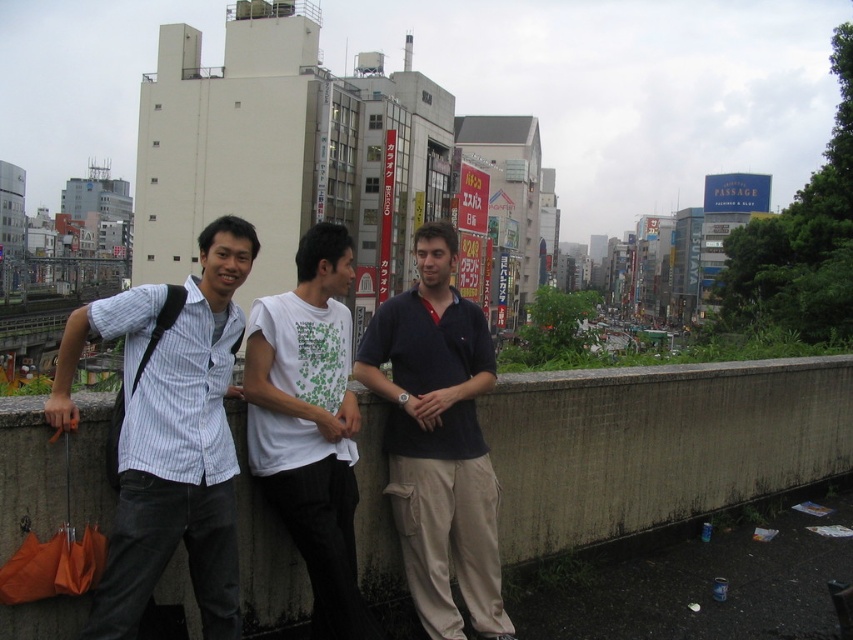
You are a photographer standing on the ledge and want to take a photo of both the striped cotton shirt at center and the dark blue polo shirt at center. The camera you have can only focus on objects within a 15 feet range. Will both subjects be in focus?

The striped cotton shirt at center and dark blue polo shirt at center are 17.73 feet apart, which exceeds the camera focus range of 15 feet. Therefore, both subjects cannot be in focus simultaneously.

Consider the image. You are planning to place a small bench on the concrete ledge at center for the dark blue polo shirt at center to sit on. Based on the space available, will the bench fit comfortably?

The concrete ledge at center occupies less space than the dark blue polo shirt at center, so the bench may not fit comfortably due to limited space.